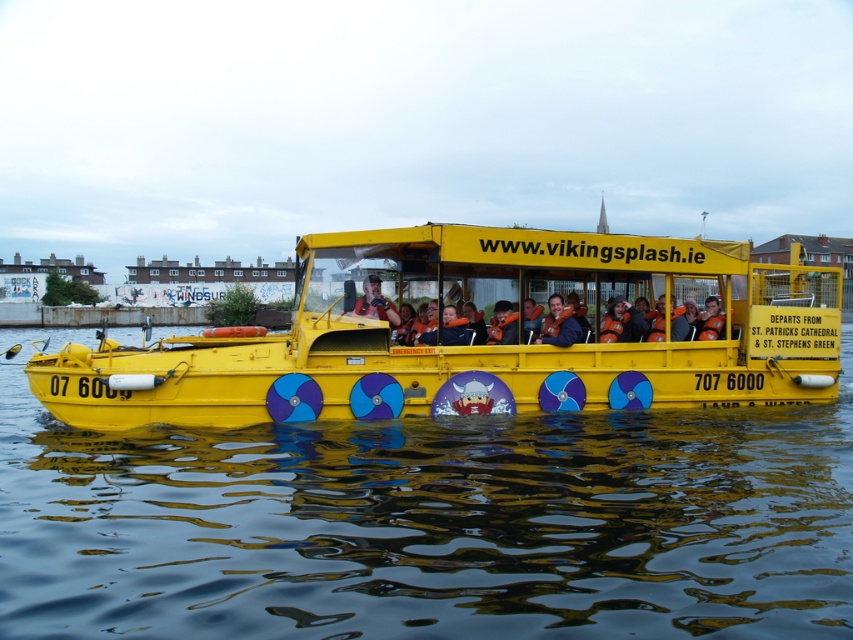
Question: Does transparent water at center have a greater width compared to matte black life vest at center?

Choices:
 (A) yes
 (B) no

Answer: (A)

Question: Which object appears farthest from the camera in this image?

Choices:
 (A) matte black life vest at center
 (B) matte black helmet at center

Answer: (B)

Question: Can you confirm if matte orange life vest at center is positioned to the left of matte black helmet at center?

Choices:
 (A) no
 (B) yes

Answer: (A)

Question: In this image, where is matte orange life vest at center located relative to matte black helmet at center?

Choices:
 (A) right
 (B) left

Answer: (A)

Question: Which object is positioned farthest from the orange life vest at center?

Choices:
 (A) matte orange life vest at center
 (B) transparent water at center
 (C) matte black life vest at center
 (D) matte black helmet at center

Answer: (B)

Question: Which object is positioned farthest from the transparent water at center?

Choices:
 (A) matte black life vest at center
 (B) yellow matte boat at center
 (C) matte orange life vest at center

Answer: (C)